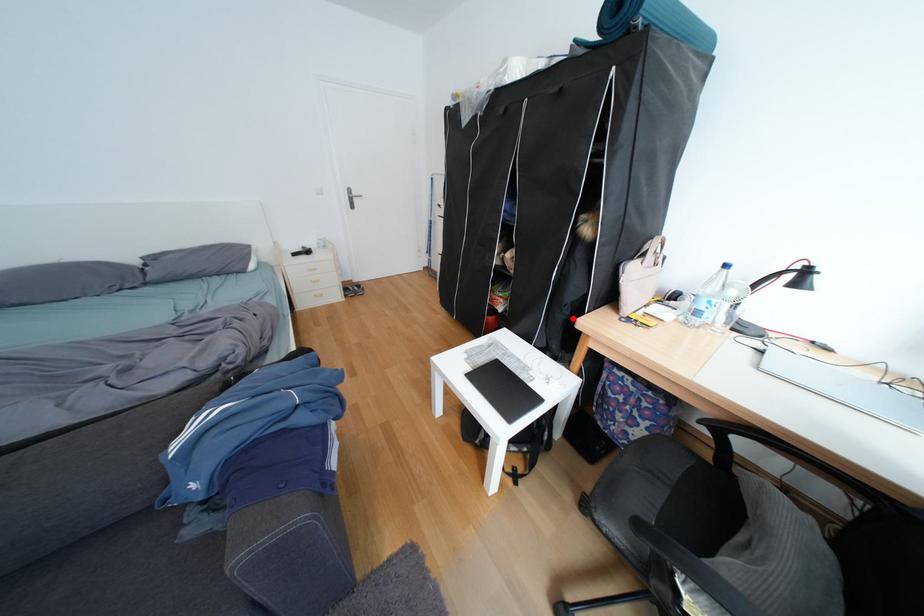
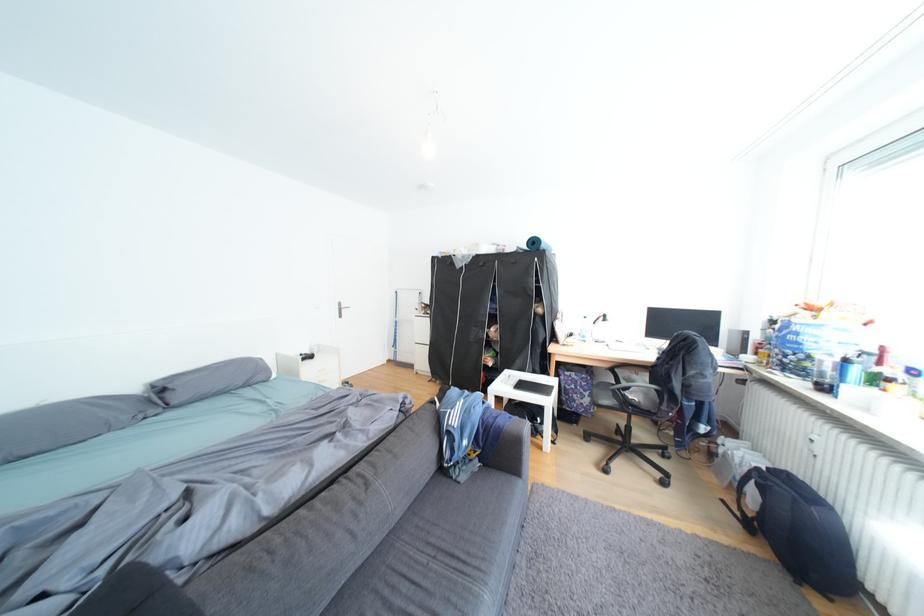
Where in the second image is the point corresponding to the highlighted location from the first image?

(552, 352)